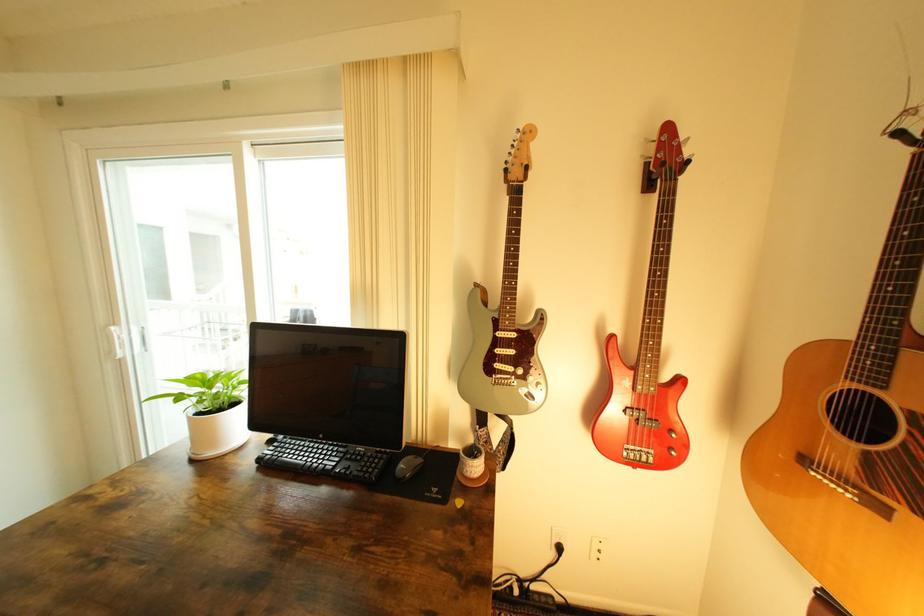
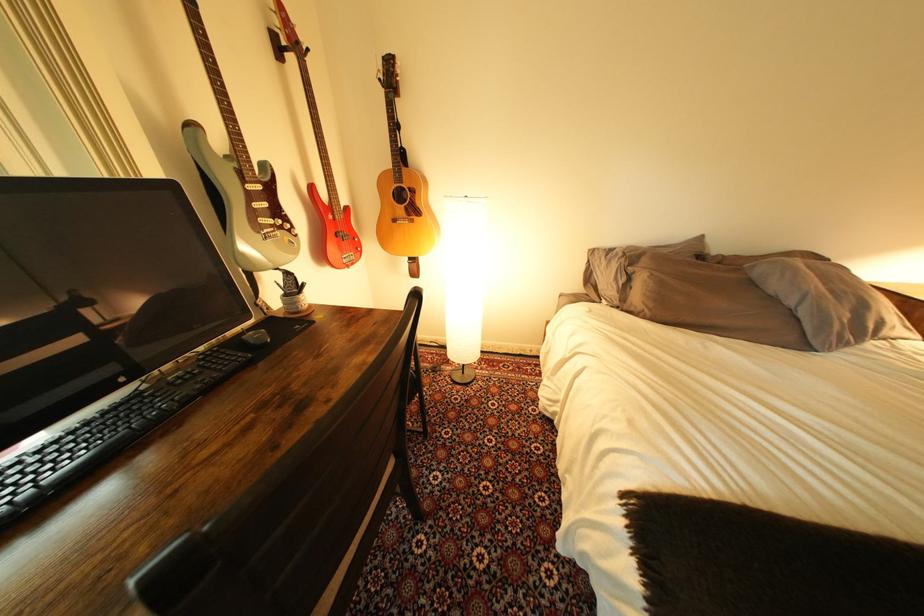
Find the pixel in the second image that matches (476,464) in the first image.

(309, 304)